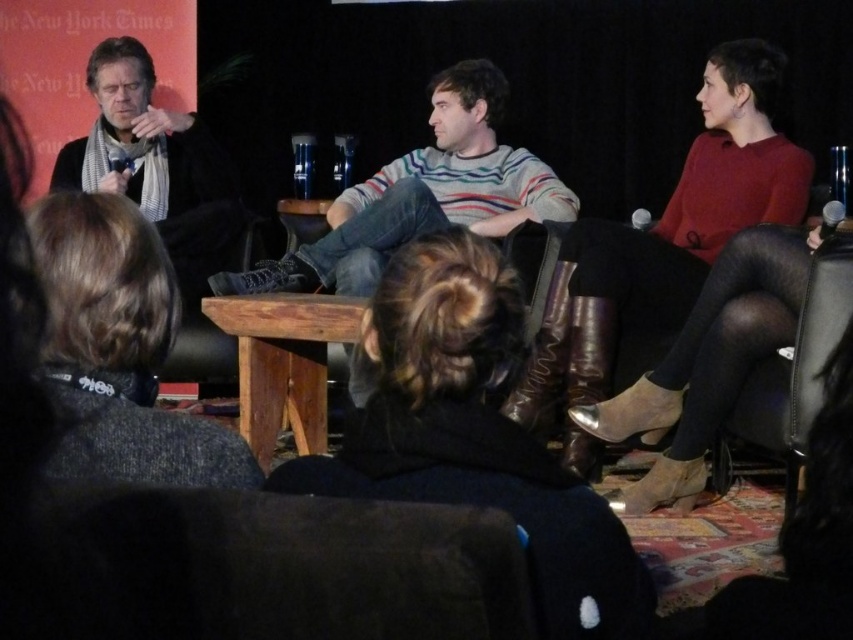
You are a photographer trying to capture a candid shot of the panel discussion. You notice the dark brown hair at lower left and the wooden table at center. Which object would appear narrower in your photo?

The dark brown hair at lower left has a lesser width compared to the wooden table at center, so it would appear narrower in the photo.

From the picture: You are sitting in the audience of this panel discussion and want to move to the wooden table at center. Which direction should you move relative to your current position in the black leather chair at right?

Since the black leather chair at right is to the right of the wooden table at center, you should move to the left to reach the wooden table at center from your current position in the black leather chair at right.